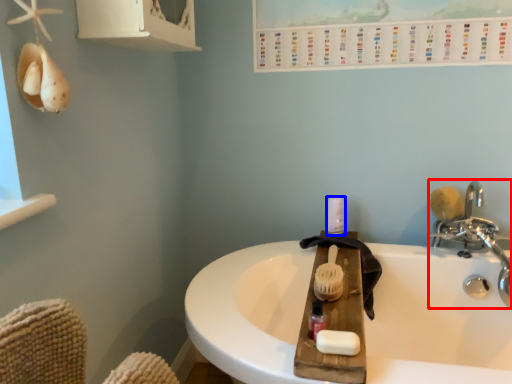
Question: Which point is further to the camera, tap (highlighted by a red box) or toiletry (highlighted by a blue box)?

Choices:
 (A) tap
 (B) toiletry

Answer: (B)